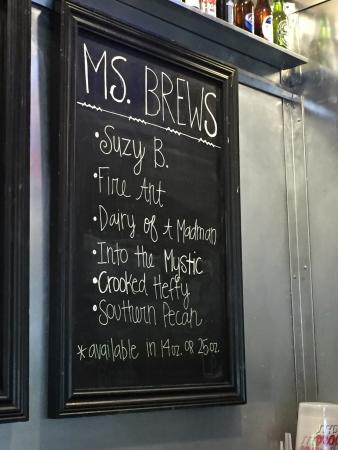
At what (x,y) coordinates should I click in order to perform the action: click on bottles. Please return your answer as a coordinate pair (x, y). Image resolution: width=338 pixels, height=450 pixels. Looking at the image, I should click on (281, 23), (263, 21), (247, 2), (229, 10), (226, 8).